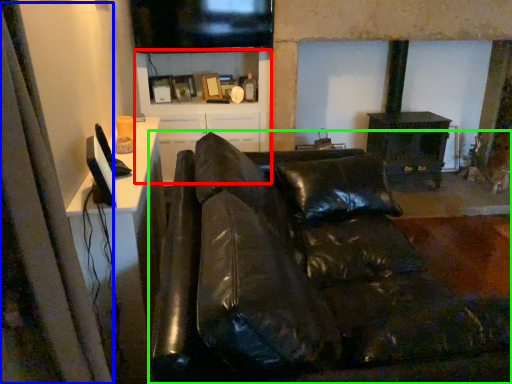
Question: Which object is the closest to the tv cabinet (highlighted by a red box)? Choose among these: curtain (highlighted by a blue box) or studio couch (highlighted by a green box).

Choices:
 (A) curtain
 (B) studio couch

Answer: (B)